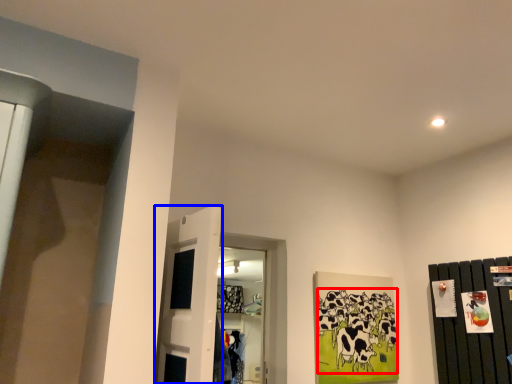
Question: Which object appears farthest to the camera in this image, animal (highlighted by a red box) or door (highlighted by a blue box)?

Choices:
 (A) animal
 (B) door

Answer: (A)